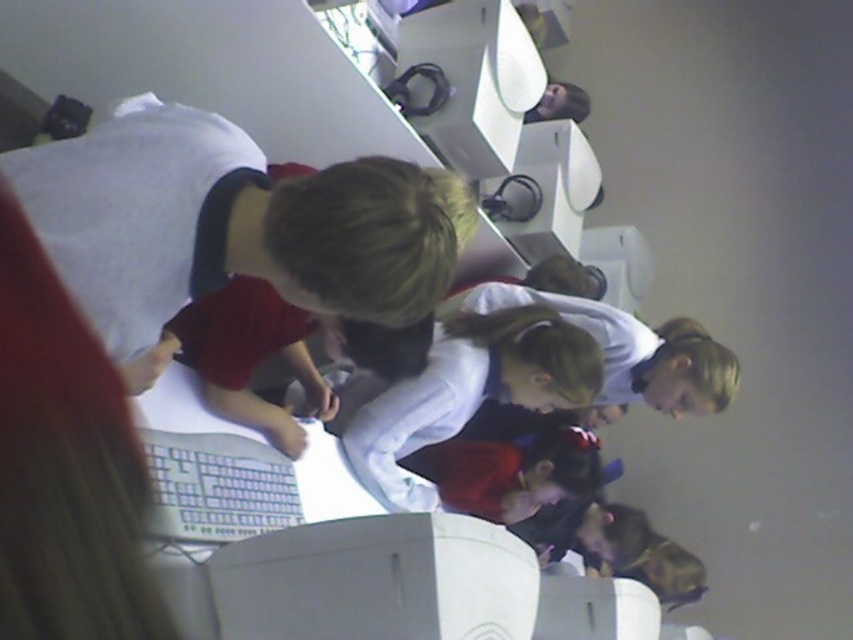
Between matte red shirt at center and white matte shirt at center, which one appears on the right side from the viewer's perspective?

white matte shirt at center

Can you confirm if matte red shirt at center is bigger than white matte shirt at center?

Incorrect, matte red shirt at center is not larger than white matte shirt at center.

Between point (97, 241) and point (508, 401), which one is positioned behind?

The point (508, 401) is more distant.

Identify the location of matte red shirt at center. This screenshot has height=640, width=853. (225, 225).

Consider the image. Can you confirm if matte red shirt at center is taller than white glossy monitor at center?

Correct, matte red shirt at center is much taller as white glossy monitor at center.

Consider the image. Which of these two, matte red shirt at center or white glossy monitor at center, stands shorter?

Standing shorter between the two is white glossy monitor at center.

Is point (251, 236) positioned after point (418, 547)?

That is False.

At what (x,y) coordinates should I click in order to perform the action: click on matte red shirt at center. Please return your answer as a coordinate pair (x, y). The height and width of the screenshot is (640, 853). Looking at the image, I should click on (225, 225).

Which is behind, point (227, 627) or point (502, 456)?

The point (502, 456) is more distant.

Is white glossy monitor at center below dark red fabric at center?

Incorrect, white glossy monitor at center is not positioned below dark red fabric at center.

Between point (289, 589) and point (531, 464), which one is positioned behind?

The point (531, 464) is behind.

What are the coordinates of `white glossy monitor at center` in the screenshot? It's located at (376, 580).